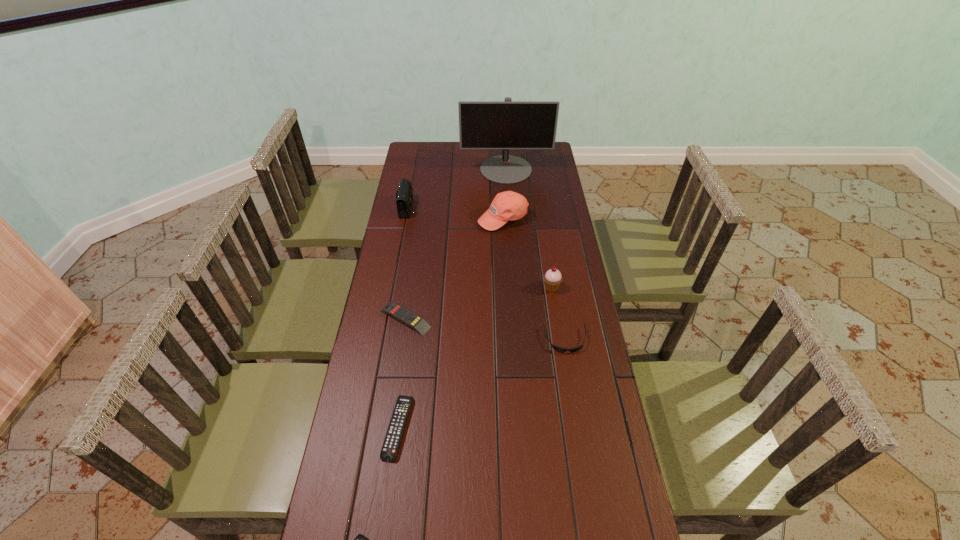
Identify the location of vacant area situated on the screen of the computer monitor. The width and height of the screenshot is (960, 540). (509, 204).

Where is `vacant space located on the right of the baseball cap`? Image resolution: width=960 pixels, height=540 pixels. vacant space located on the right of the baseball cap is located at coordinates (540, 218).

I want to click on blank area located on the front flap of the clutch bag, so click(492, 207).

Find the location of a particular element. Image resolution: width=960 pixels, height=540 pixels. free space located on the back of the cupcake is located at coordinates (541, 219).

Find the location of a particular element. vacant space located 0.320m on the back of the farthest remote control is located at coordinates (417, 242).

This screenshot has width=960, height=540. In order to click on vacant space situated 0.380m on the front-facing side of the sunglasses in this screenshot , I will do `click(588, 477)`.

Where is `free space located on the front of the bigger black remote control`? free space located on the front of the bigger black remote control is located at coordinates (389, 495).

You are a GUI agent. You are given a task and a screenshot of the screen. Output one action in this format:
    pyautogui.click(x=<x>, y=<y>)
    Task: Click on the object present at the far edge
    
    Given the screenshot: What is the action you would take?
    pyautogui.click(x=507, y=124)

Find the location of a particular element. clutch bag that is positioned at the left edge is located at coordinates (404, 197).

Locate an element on the screen. computer monitor that is at the right edge is located at coordinates (507, 124).